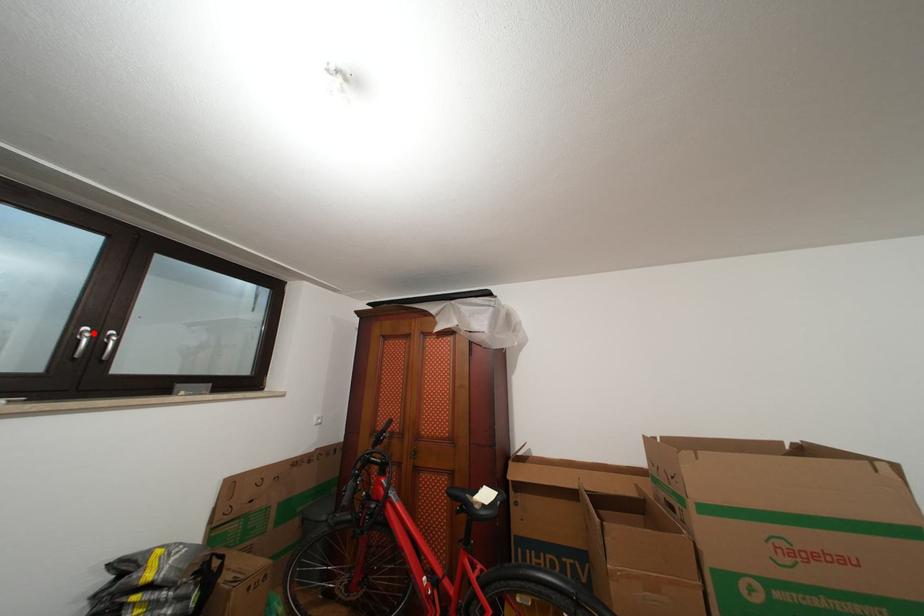
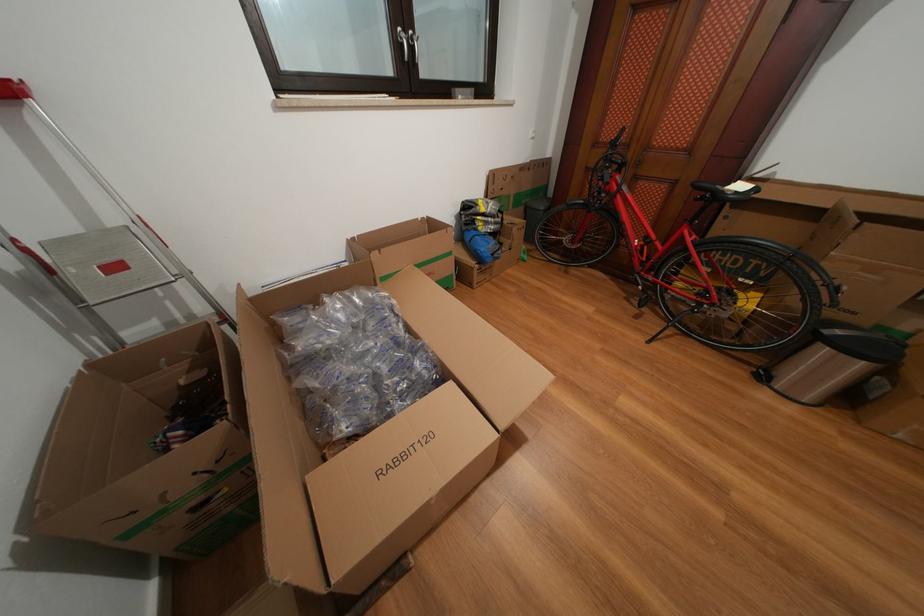
Question: I am providing you with two images of the same scene from different viewpoints. Given a red point in image1, look at the same physical point in image2. Is it:

Choices:
 (A) Closer to the viewpoint
 (B) Farther from the viewpoint

Answer: (A)